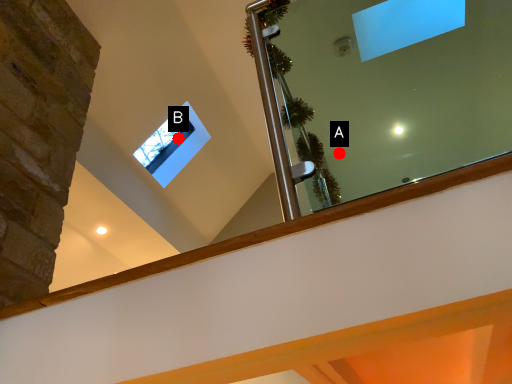
Question: Two points are circled on the image, labeled by A and B beside each circle. Which point is farther to the camera?

Choices:
 (A) A is further
 (B) B is further

Answer: (A)